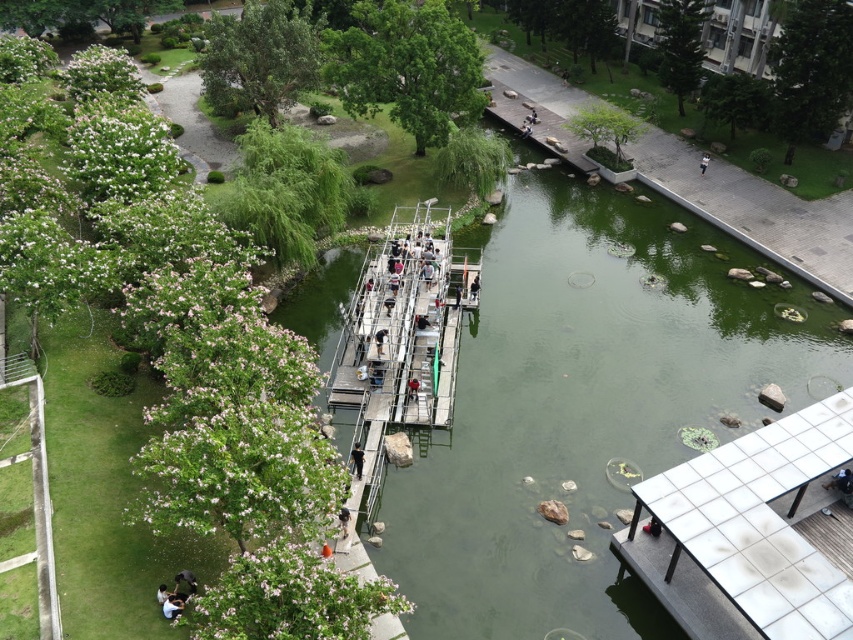
Is point (844, 426) closer to viewer compared to point (178, 584)?

No, it is not.

Does white tile dock at lower right appear over dark blue jeans at lower left?

Yes, white tile dock at lower right is above dark blue jeans at lower left.

Who is more forward, (746, 465) or (192, 577)?

Point (192, 577) is more forward.

Locate an element on the screen. This screenshot has height=640, width=853. white tile dock at lower right is located at coordinates (751, 532).

Is dark blue shirt at lower left thinner than dark blue jeans at lower left?

Indeed, dark blue shirt at lower left has a lesser width compared to dark blue jeans at lower left.

In the scene shown: Is dark blue shirt at lower left closer to camera compared to dark blue jeans at lower left?

Yes, dark blue shirt at lower left is in front of dark blue jeans at lower left.

Does point (178, 612) come behind point (178, 572)?

That is False.

This screenshot has height=640, width=853. In order to click on dark blue shirt at lower left in this screenshot , I will do `click(172, 605)`.

Can you confirm if dark blue jeans at center is positioned to the right of dark brown leather jacket at lower center?

Correct, you'll find dark blue jeans at center to the right of dark brown leather jacket at lower center.

Between point (357, 467) and point (341, 531), which one is positioned in front?

Point (341, 531)

Image resolution: width=853 pixels, height=640 pixels. Identify the location of dark blue jeans at center. (357, 460).

The height and width of the screenshot is (640, 853). I want to click on dark blue jeans at center, so point(357,460).